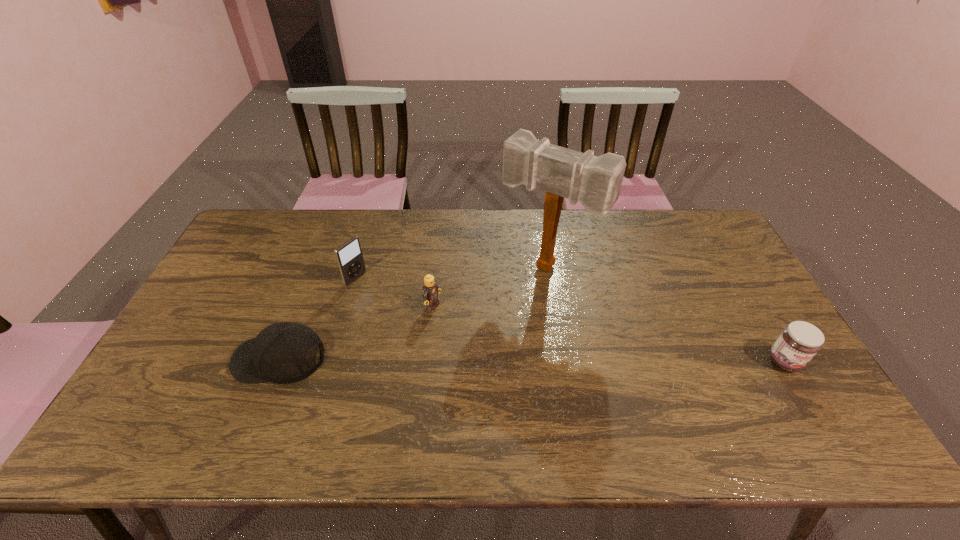
Image resolution: width=960 pixels, height=540 pixels. I want to click on cap, so click(x=285, y=352).

Image resolution: width=960 pixels, height=540 pixels. I want to click on jam, so click(799, 342).

Image resolution: width=960 pixels, height=540 pixels. Find the location of `the tallest object`. the tallest object is located at coordinates (595, 182).

Find the location of a particular element. This screenshot has height=540, width=960. the second object from right to left is located at coordinates tap(595, 182).

Where is `the second tallest object`? Image resolution: width=960 pixels, height=540 pixels. the second tallest object is located at coordinates (349, 257).

Find the location of `the third object from left to right`. the third object from left to right is located at coordinates (430, 292).

Where is `Lego`? Lego is located at coordinates (430, 292).

The width and height of the screenshot is (960, 540). I want to click on free region located on the front-facing side of the cap, so pyautogui.click(x=170, y=358).

Where is `free space located on the front-facing side of the cap`? The image size is (960, 540). free space located on the front-facing side of the cap is located at coordinates (207, 358).

In order to click on free space located on the front-facing side of the cap in this screenshot , I will do `click(211, 358)`.